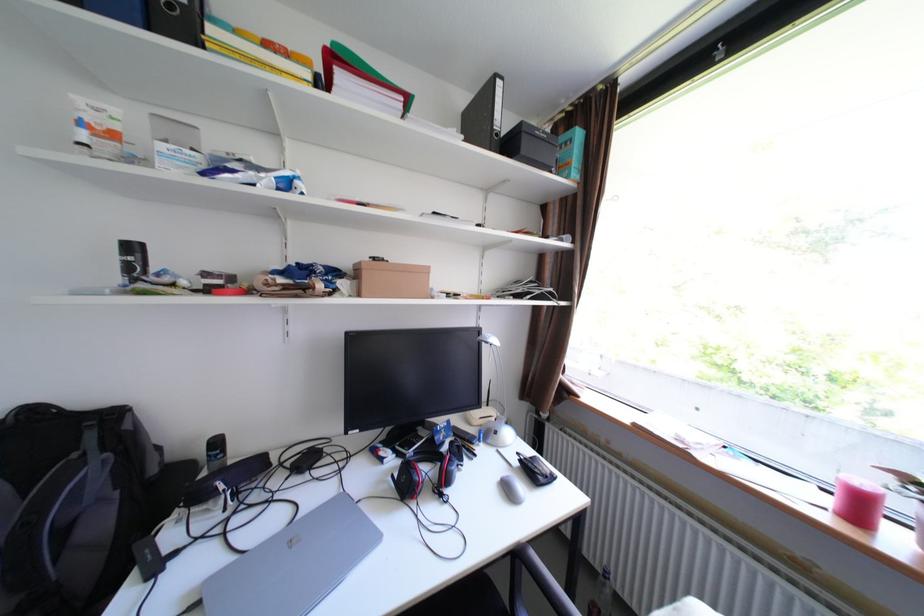
Find where to resting arm on the chair armrest. Please return your answer as a coordinate pair (x, y).

(56, 536)